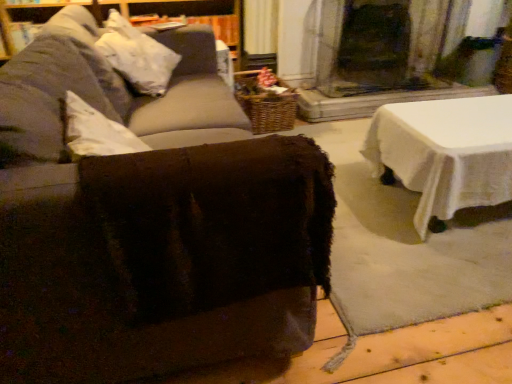
Question: From a real-world perspective, relative to brown fuzzy ottoman at center, is woven brown basket at center vertically above or below?

Choices:
 (A) above
 (B) below

Answer: (B)

Question: From the image's perspective, is woven brown basket at center located above or below brown fuzzy ottoman at center?

Choices:
 (A) below
 (B) above

Answer: (B)

Question: Considering the real-world distances, which object is closest to the brown fuzzy ottoman at center?

Choices:
 (A) woven brown basket at center
 (B) white fabric pillow at upper left

Answer: (B)

Question: Which is farther from the woven brown basket at center?

Choices:
 (A) white fabric pillow at upper left
 (B) brown fuzzy ottoman at center

Answer: (B)